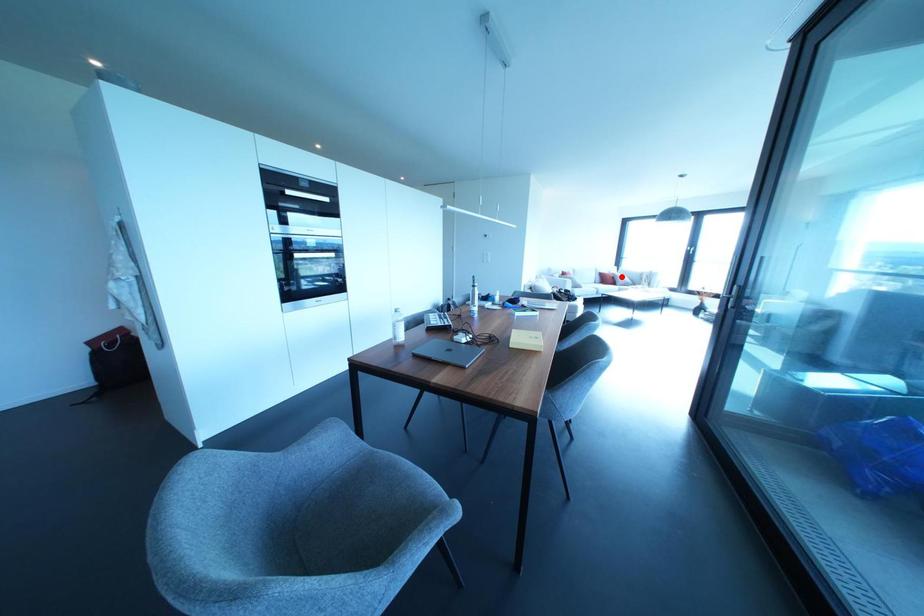
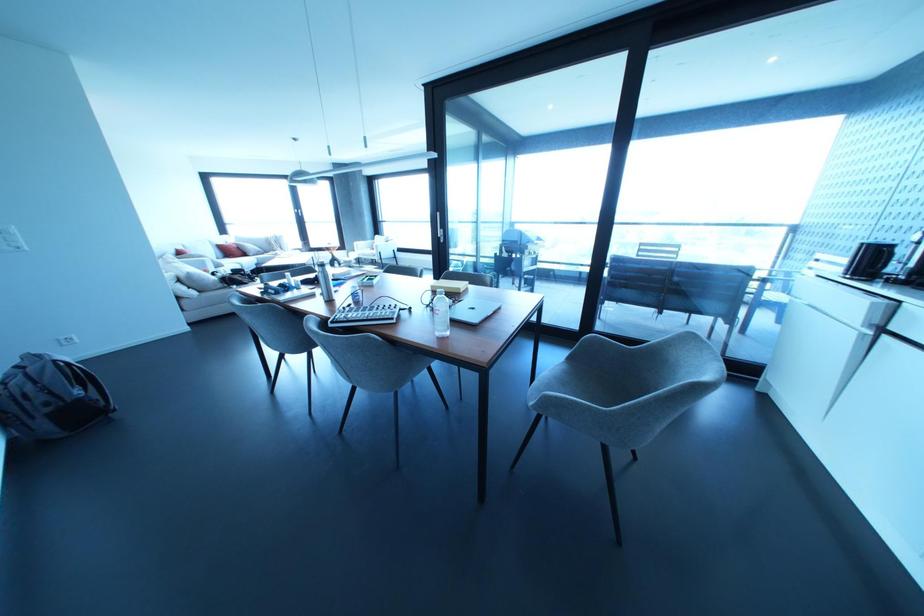
Question: I am providing you with two images of the same scene from different viewpoints. A red point is marked on the first image. Is the red point's position out of view in image 2?

Choices:
 (A) Yes
 (B) No

Answer: (B)